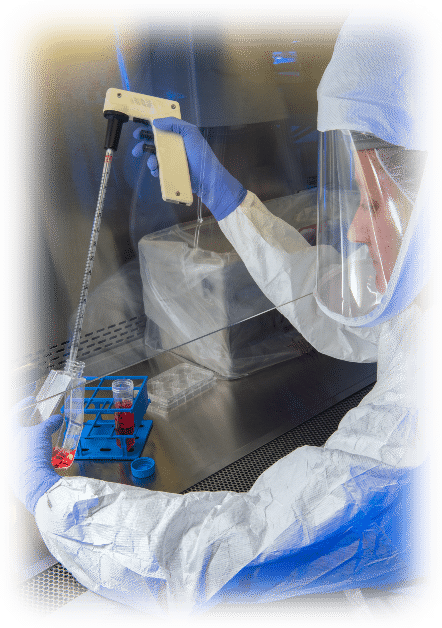
Find the location of a particular element. grey wall is located at coordinates (71, 104).